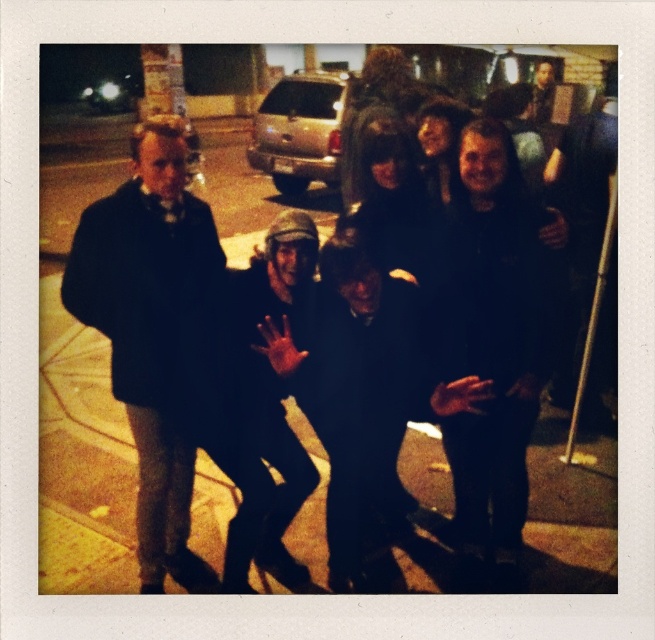
Question: Among these objects, which one is farthest from the camera?

Choices:
 (A) dark gray knit hat at center
 (B) dark brown leather jacket at center
 (C) dark wool coat at left

Answer: (A)

Question: Where is dark wool coat at left located in relation to black fuzzy jacket at center in the image?

Choices:
 (A) above
 (B) below

Answer: (A)

Question: Based on their relative distances, which object is nearer to the dark wool coat at left?

Choices:
 (A) dark gray knit hat at center
 (B) dark brown leather jacket at center
 (C) black fuzzy jacket at center

Answer: (A)

Question: In this image, where is dark wool coat at left located relative to black fuzzy jacket at center?

Choices:
 (A) left
 (B) right

Answer: (A)

Question: Can you confirm if dark wool coat at left is positioned above dark brown leather jacket at center?

Choices:
 (A) yes
 (B) no

Answer: (A)

Question: Among these points, which one is nearest to the camera?

Choices:
 (A) (248, 417)
 (B) (481, 317)
 (C) (77, 234)

Answer: (C)